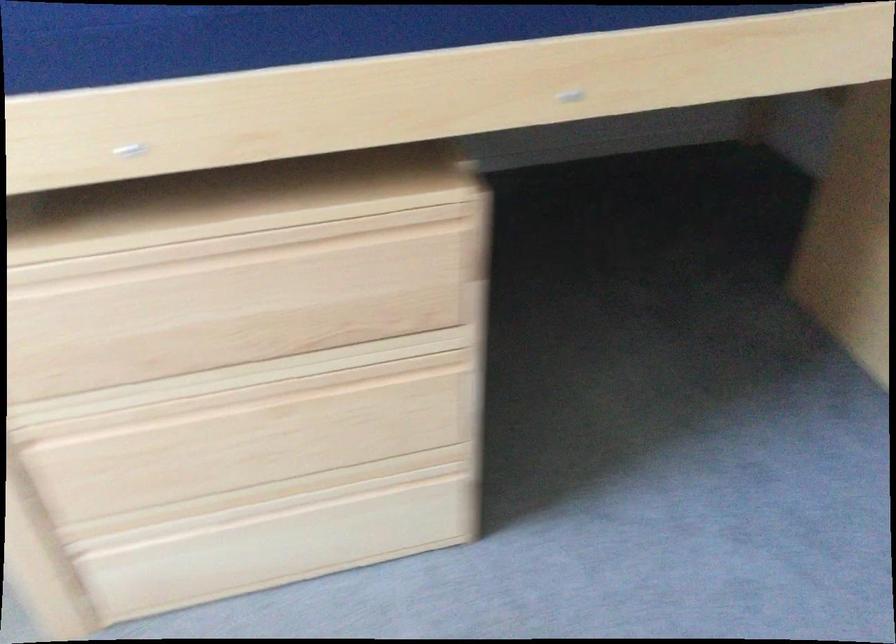
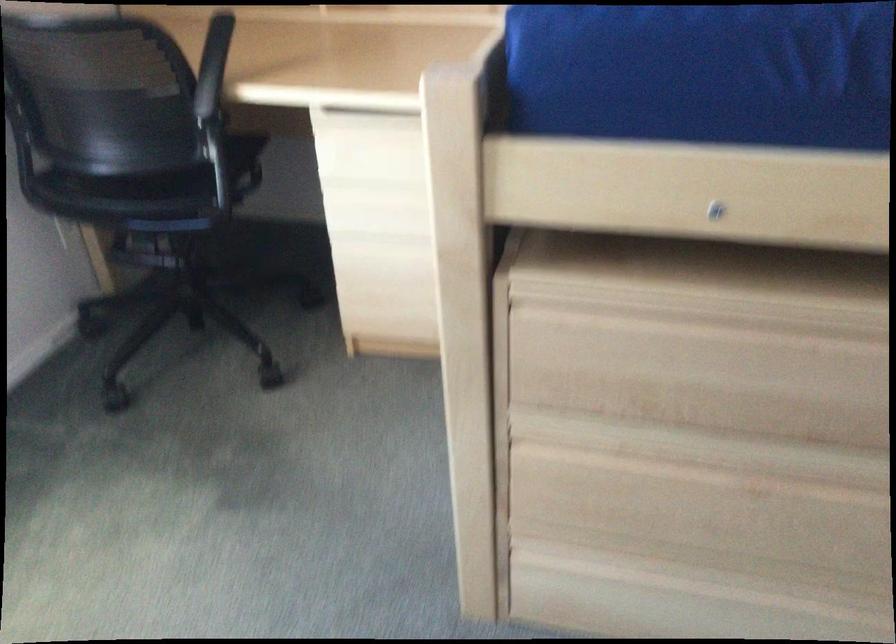
The point at (239, 379) is marked in the first image. Where is the corresponding point in the second image?

(716, 451)